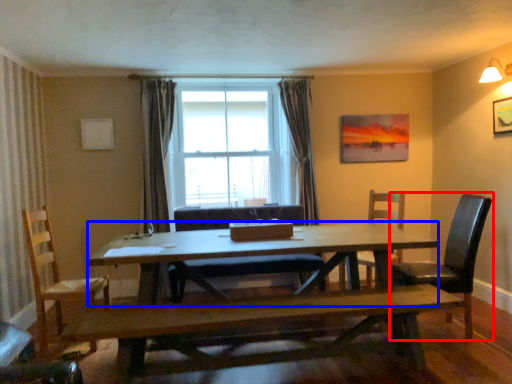
Question: Which object is further to the camera taking this photo, chair (highlighted by a red box) or kitchen & dining room table (highlighted by a blue box)?

Choices:
 (A) chair
 (B) kitchen & dining room table

Answer: (A)